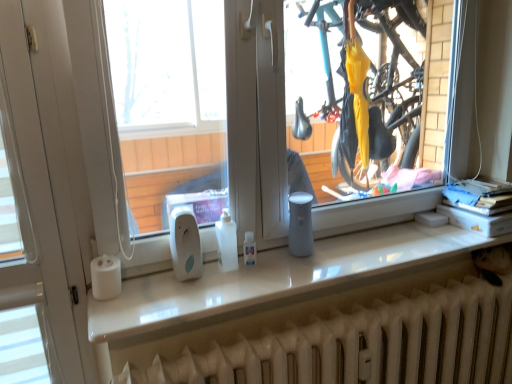
I want to click on blank space situated above white glossy counter top at center (from a real-world perspective), so click(318, 260).